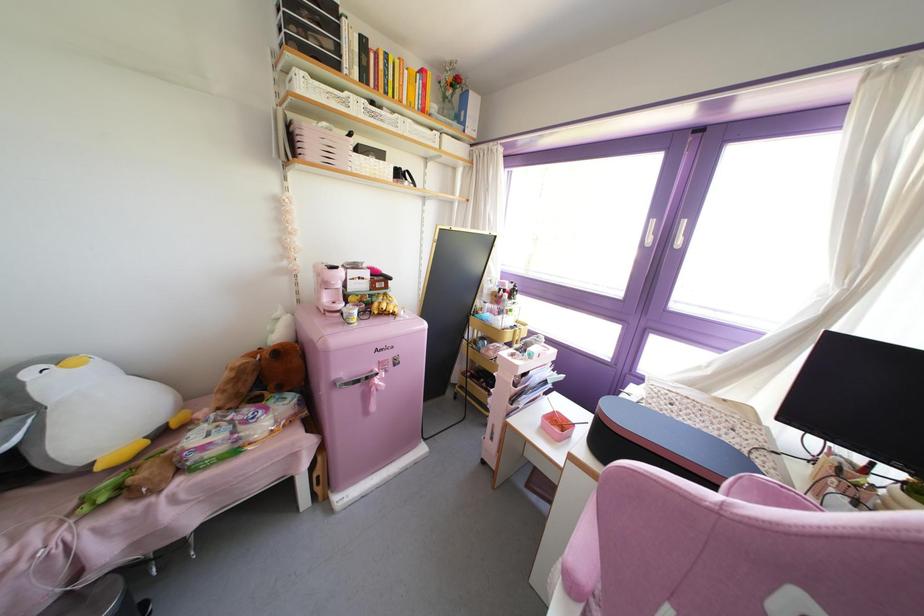
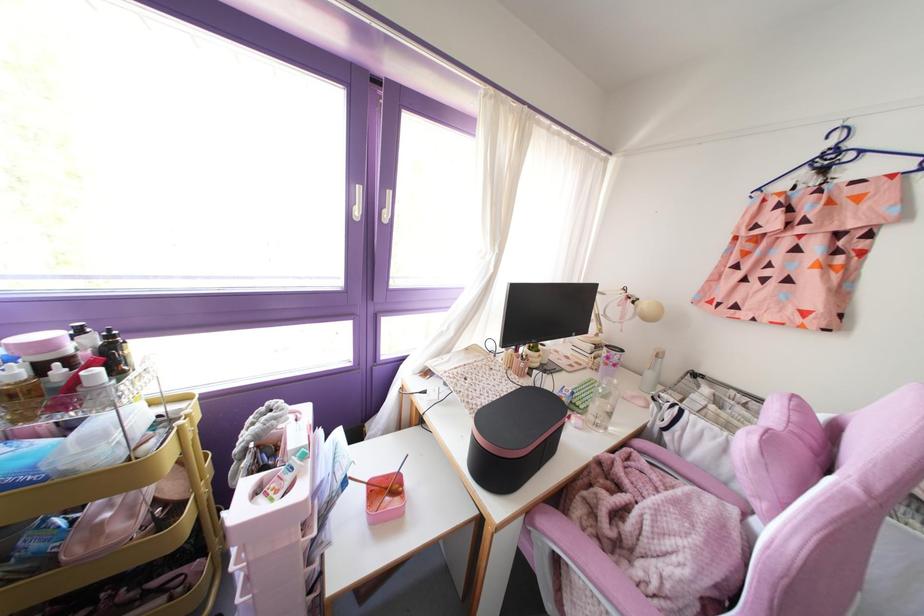
In the second image, find the point that corresponds to pixel 504 290 in the first image.

(67, 360)